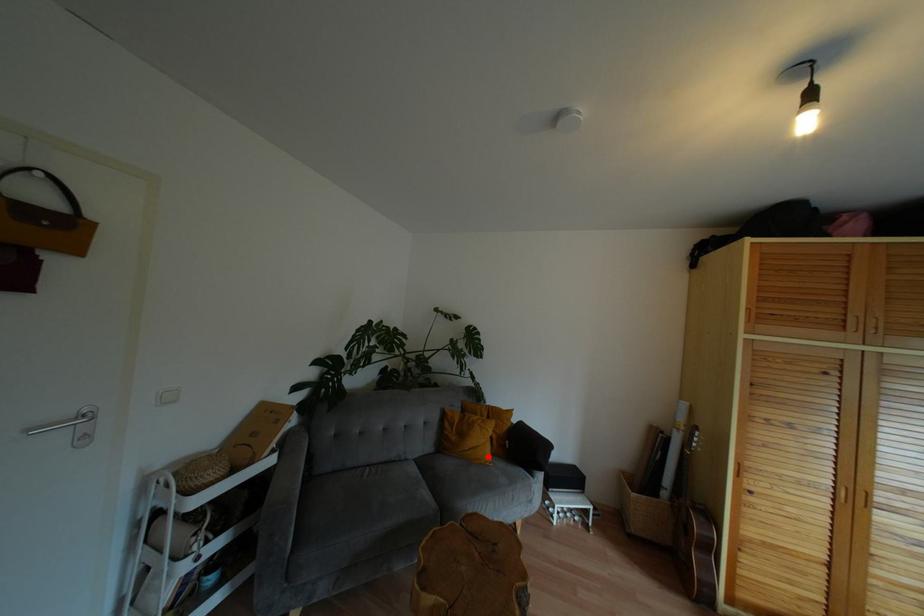
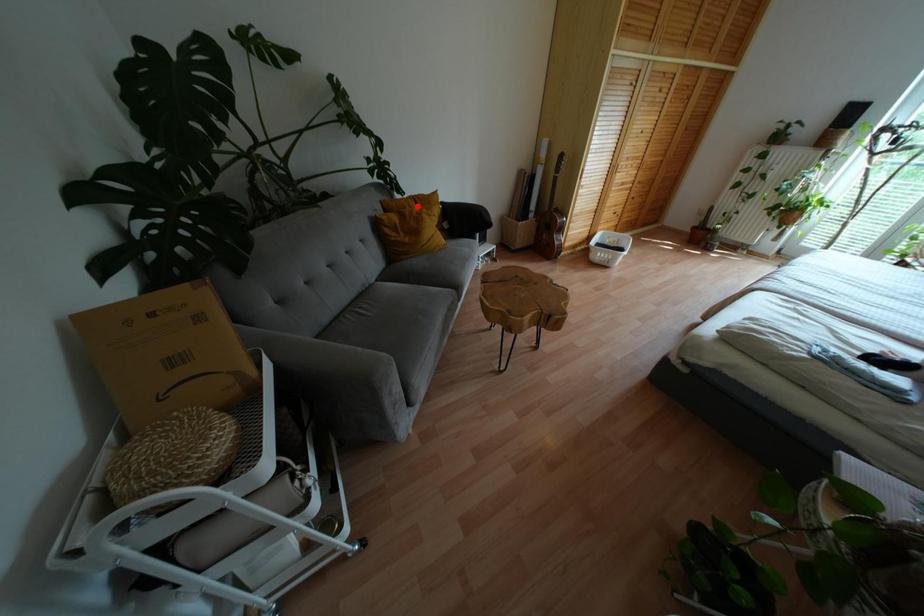
I am providing you with two images of the same scene from different viewpoints. A red point is marked on the first image and another point is marked on the second image. Does the point marked in image1 correspond to the same location as the one in image2?

No